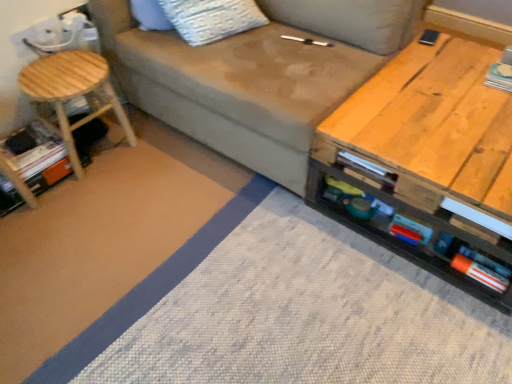
Describe the element at coordinates (426, 154) in the screenshot. This screenshot has height=384, width=512. I see `wooden table at right` at that location.

Measure the distance between natural wood stool at left and camera.

A distance of 1.61 meters exists between natural wood stool at left and camera.

Measure the distance between orange cardboard book at lower left, which appears as the second book when viewed from the top, and camera.

They are 1.67 meters apart.

Locate an element on the screen. The image size is (512, 384). white paper book at upper right, the 2th book positioned from the left is located at coordinates (500, 77).

Locate an element on the screen. wooden table at right is located at coordinates (426, 154).

In order to click on stool below the matte gray fabric couch at center (from a real-world perspective) in this screenshot , I will do `click(73, 93)`.

Can you confirm if natural wood stool at left is smaller than matte gray fabric couch at center?

Yes.

Is natural wood stool at left next to matte gray fabric couch at center and touching it?

No, natural wood stool at left is not in contact with matte gray fabric couch at center.

From a real-world perspective, is orange cardboard book at lower left, which appears as the second book when viewed from the top, positioned above or below natural wood stool at left?

In terms of real-world spatial position, orange cardboard book at lower left, which appears as the second book when viewed from the top, is below natural wood stool at left.

Is orange cardboard book at lower left, which appears as the second book when viewed from the top, facing towards natural wood stool at left?

No.

From the picture: Is orange cardboard book at lower left, which appears as the second book when viewed from the top, situated inside natural wood stool at left or outside?

orange cardboard book at lower left, which appears as the second book when viewed from the top, is located beyond the bounds of natural wood stool at left.

From a real-world perspective, does natural wood stool at left stand above white paper book at upper right, the 2th book positioned from the left?

No, from a real-world perspective, natural wood stool at left is not over white paper book at upper right, the 2th book positioned from the left

Locate an element on the screen. book on the right of natural wood stool at left is located at coordinates (500, 77).

Could you tell me if natural wood stool at left is turned towards white paper book at upper right, the 2th book positioned from the left?

No, natural wood stool at left is not turned towards white paper book at upper right, the 2th book positioned from the left.

From their relative heights in the image, would you say orange cardboard book at lower left, marked as the first book in a bottom-to-top arrangement, is taller or shorter than wooden table at right?

Considering their sizes, orange cardboard book at lower left, marked as the first book in a bottom-to-top arrangement, has less height than wooden table at right.

Is orange cardboard book at lower left, the 1th book in the left-to-right sequence, further to the viewer compared to wooden table at right?

Yes, it is.

Between orange cardboard book at lower left, the 1th book in the left-to-right sequence, and wooden table at right, which one has smaller width?

orange cardboard book at lower left, the 1th book in the left-to-right sequence.

In order to click on table lying on the right of orange cardboard book at lower left, the 1th book in the left-to-right sequence in this screenshot , I will do `click(426, 154)`.

How many degrees apart are the facing directions of wooden table at right and orange cardboard book at lower left, which appears as the second book when viewed from the top?

The angle between the facing direction of wooden table at right and the facing direction of orange cardboard book at lower left, which appears as the second book when viewed from the top, is 88.8 degrees.

Consider the image. From a real-world perspective, is wooden table at right located beneath orange cardboard book at lower left, which is the second book from right to left?

No, from a real-world perspective, wooden table at right is not below orange cardboard book at lower left, which is the second book from right to left.

From the image's perspective, which is below, wooden table at right or orange cardboard book at lower left, the 1th book in the left-to-right sequence?

orange cardboard book at lower left, the 1th book in the left-to-right sequence.

Is wooden table at right far away from orange cardboard book at lower left, marked as the first book in a bottom-to-top arrangement?

Yes, wooden table at right and orange cardboard book at lower left, marked as the first book in a bottom-to-top arrangement, are quite far apart.

Is wooden table at right touching matte gray fabric couch at center?

There is a gap between wooden table at right and matte gray fabric couch at center.

Which is in front, point (402, 110) or point (316, 124)?

The point (316, 124) is more forward.

Is matte gray fabric couch at center at the back of wooden table at right?

No, wooden table at right is not facing the opposite direction of matte gray fabric couch at center.

Does wooden table at right come behind matte gray fabric couch at center?

No, the depth of wooden table at right is less than that of matte gray fabric couch at center.

Between white paper book at upper right, which is counted as the 1th book, starting from the right, and orange cardboard book at lower left, the 1th book in the left-to-right sequence, which one has larger size?

orange cardboard book at lower left, the 1th book in the left-to-right sequence.

Which object is more forward, white paper book at upper right, the 2th book positioned from the left, or orange cardboard book at lower left, the 1th book in the left-to-right sequence?

white paper book at upper right, the 2th book positioned from the left, is in front.

Considering the relative positions of white paper book at upper right, which is counted as the 1th book, starting from the right, and orange cardboard book at lower left, the 1th book in the left-to-right sequence, in the image provided, is white paper book at upper right, which is counted as the 1th book, starting from the right, to the right of orange cardboard book at lower left, the 1th book in the left-to-right sequence, from the viewer's perspective?

Yes, white paper book at upper right, which is counted as the 1th book, starting from the right, is to the right of orange cardboard book at lower left, the 1th book in the left-to-right sequence.

Is point (510, 73) positioned in front of point (4, 179)?

Yes, it is in front of point (4, 179).

Where is `studio couch above the natural wood stool at left (from the image's perspective)`? The width and height of the screenshot is (512, 384). studio couch above the natural wood stool at left (from the image's perspective) is located at coordinates (257, 75).

This screenshot has width=512, height=384. I want to click on stool that is on the right side of orange cardboard book at lower left, the 1th book in the left-to-right sequence, so click(x=73, y=93).

Looking at this image, which object lies nearer to the anchor point natural wood stool at left, wooden table at right or white paper book at upper right, acting as the 1th book starting from the top?

wooden table at right is closer to natural wood stool at left.

Estimate the real-world distances between objects in this image. Which object is further from wooden table at right, natural wood stool at left or white paper book at upper right, the 2th book positioned from the left?

natural wood stool at left is positioned further to the anchor wooden table at right.

Which object lies nearer to the anchor point matte gray fabric couch at center, orange cardboard book at lower left, marked as the first book in a bottom-to-top arrangement, or natural wood stool at left?

natural wood stool at left.

Based on their spatial positions, is matte gray fabric couch at center or orange cardboard book at lower left, the 1th book in the left-to-right sequence, closer to natural wood stool at left?

orange cardboard book at lower left, the 1th book in the left-to-right sequence, is closer to natural wood stool at left.

Considering their positions, is white paper book at upper right, positioned as the 2th book in bottom-to-top order, positioned closer to orange cardboard book at lower left, marked as the first book in a bottom-to-top arrangement, than natural wood stool at left?

natural wood stool at left.

From the image, which object appears to be nearer to wooden table at right, natural wood stool at left or orange cardboard book at lower left, the 1th book in the left-to-right sequence?

Among the two, natural wood stool at left is located nearer to wooden table at right.

Which object lies further to the anchor point matte gray fabric couch at center, wooden table at right or white paper book at upper right, acting as the 1th book starting from the top?

Among the two, white paper book at upper right, acting as the 1th book starting from the top, is located further to matte gray fabric couch at center.

Considering their positions, is natural wood stool at left positioned closer to orange cardboard book at lower left, marked as the first book in a bottom-to-top arrangement, than matte gray fabric couch at center?

natural wood stool at left lies closer to orange cardboard book at lower left, marked as the first book in a bottom-to-top arrangement, than the other object.

Find the location of a particular element. The height and width of the screenshot is (384, 512). table between orange cardboard book at lower left, marked as the first book in a bottom-to-top arrangement, and white paper book at upper right, which is counted as the 1th book, starting from the right, in the horizontal direction is located at coordinates (x=426, y=154).

Locate an element on the screen. The width and height of the screenshot is (512, 384). studio couch situated between orange cardboard book at lower left, the 1th book in the left-to-right sequence, and wooden table at right from left to right is located at coordinates (257, 75).

I want to click on studio couch between natural wood stool at left and wooden table at right, so click(x=257, y=75).

Identify the location of studio couch between natural wood stool at left and white paper book at upper right, acting as the 1th book starting from the top. This screenshot has width=512, height=384. (257, 75).